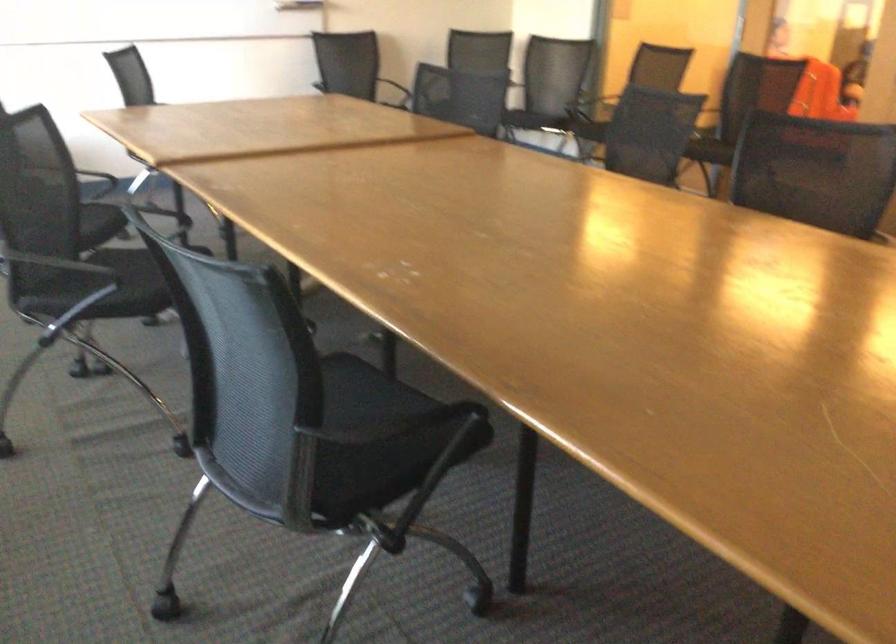
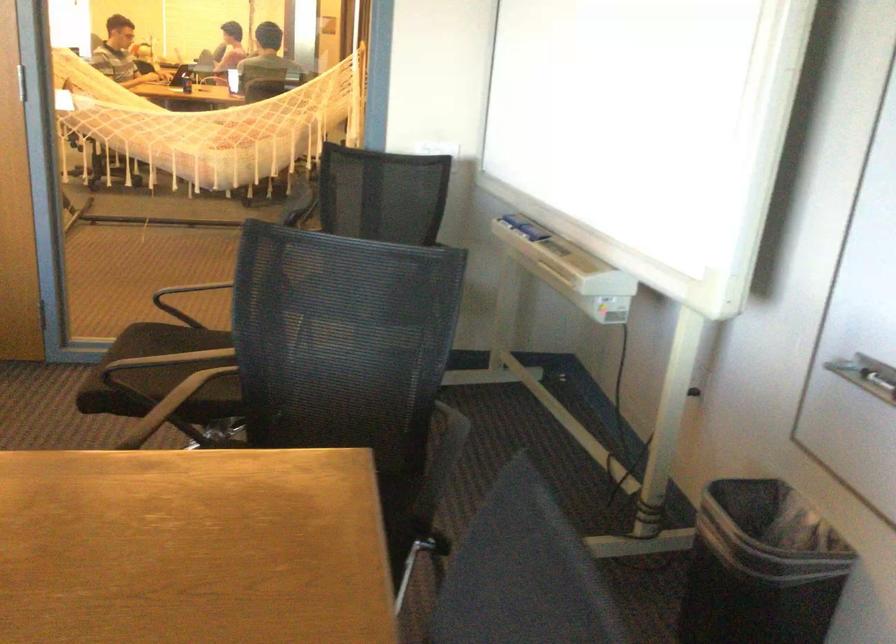
Question: The camera is either moving clockwise (left) or counter-clockwise (right) around the object. The first image is from the beginning of the video and the second image is from the end. Is the camera moving left or right when shooting the video?

Choices:
 (A) Left
 (B) Right

Answer: (A)